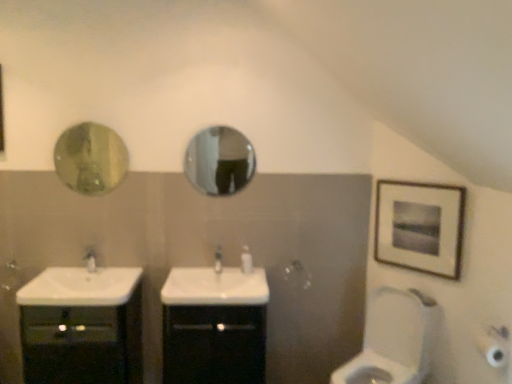
Where is `empty space that is ontop of white glossy sink at center, the 2th sink positioned from the left (from a real-world perspective)`? empty space that is ontop of white glossy sink at center, the 2th sink positioned from the left (from a real-world perspective) is located at coordinates (222, 281).